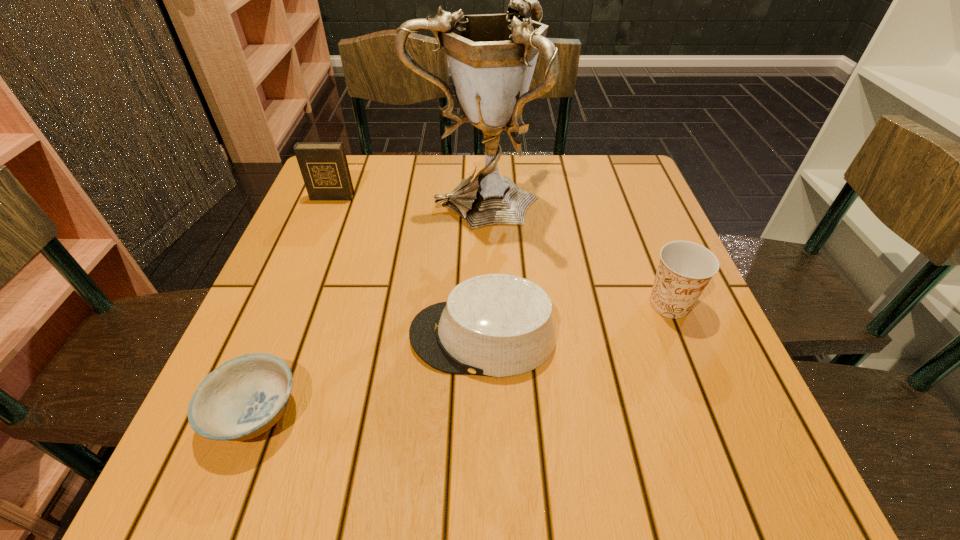
This screenshot has width=960, height=540. What are the coordinates of `object situated at the near left corner` in the screenshot? It's located at (244, 397).

In the image, there is a desktop. Where is `free space at the far edge`? free space at the far edge is located at coordinates (386, 187).

Find the location of a particular element. The image size is (960, 540). vacant point at the near edge is located at coordinates (294, 496).

Where is `vacant space at the left edge of the desktop`? vacant space at the left edge of the desktop is located at coordinates (340, 210).

In the image, there is a desktop. At what (x,y) coordinates should I click in order to perform the action: click on blank space at the right edge. Please return your answer as a coordinate pair (x, y). The width and height of the screenshot is (960, 540). Looking at the image, I should click on (670, 381).

This screenshot has height=540, width=960. I want to click on vacant space at the far right corner, so click(594, 157).

The height and width of the screenshot is (540, 960). In order to click on free space between the diary and the hat in this screenshot , I will do `click(407, 267)`.

At what (x,y) coordinates should I click in order to perform the action: click on free space between the fourth shortest object and the Dixie cup. Please return your answer as a coordinate pair (x, y). This screenshot has height=540, width=960. Looking at the image, I should click on (501, 251).

Find the location of a particular element. The image size is (960, 540). blank region between the bowl and the hat is located at coordinates (369, 374).

Image resolution: width=960 pixels, height=540 pixels. I want to click on free space that is in between the hat and the tallest object, so click(480, 269).